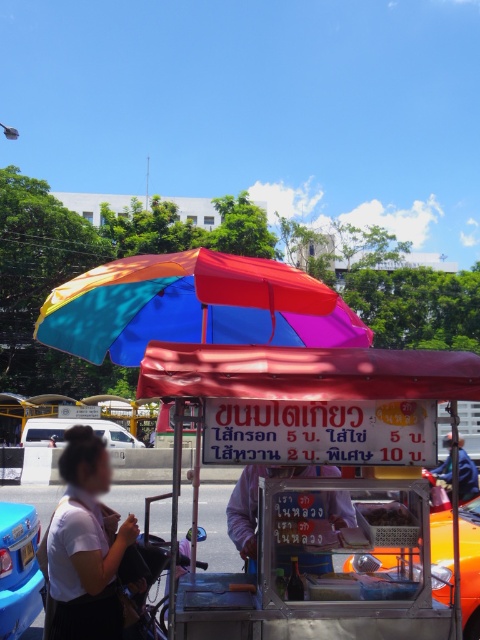
Question: Is white matte shirt at lower left behind white van at center?

Choices:
 (A) yes
 (B) no

Answer: (B)

Question: Where is metallic silver food cart at center located in relation to white matte shirt at lower left in the image?

Choices:
 (A) right
 (B) left

Answer: (A)

Question: Which object appears closest to the camera in this image?

Choices:
 (A) metallic orange taxi at lower right
 (B) rainbow fabric umbrella at center
 (C) dark brown matte food at center

Answer: (B)

Question: Which point is closer to the camera taking this photo?

Choices:
 (A) (385, 515)
 (B) (229, 506)

Answer: (A)

Question: Can you confirm if white matte shirt at lower left is positioned above white van at center?

Choices:
 (A) yes
 (B) no

Answer: (A)

Question: Which point appears farthest from the camera in this image?

Choices:
 (A) (317, 556)
 (B) (80, 438)
 (C) (120, 426)

Answer: (C)